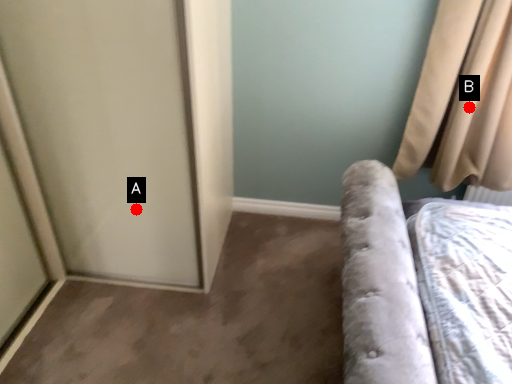
Question: Two points are circled on the image, labeled by A and B beside each circle. Which of the following is the farthest from the observer?

Choices:
 (A) A is further
 (B) B is further

Answer: (B)